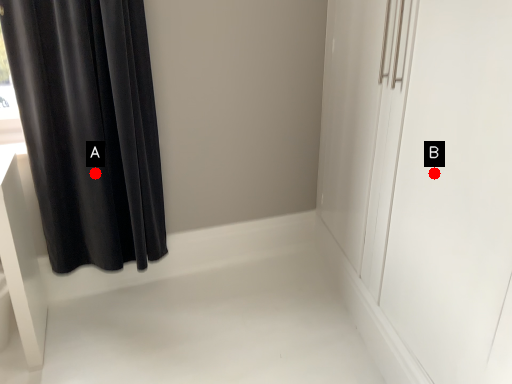
Question: Two points are circled on the image, labeled by A and B beside each circle. Which point is farther to the camera?

Choices:
 (A) A is further
 (B) B is further

Answer: (A)